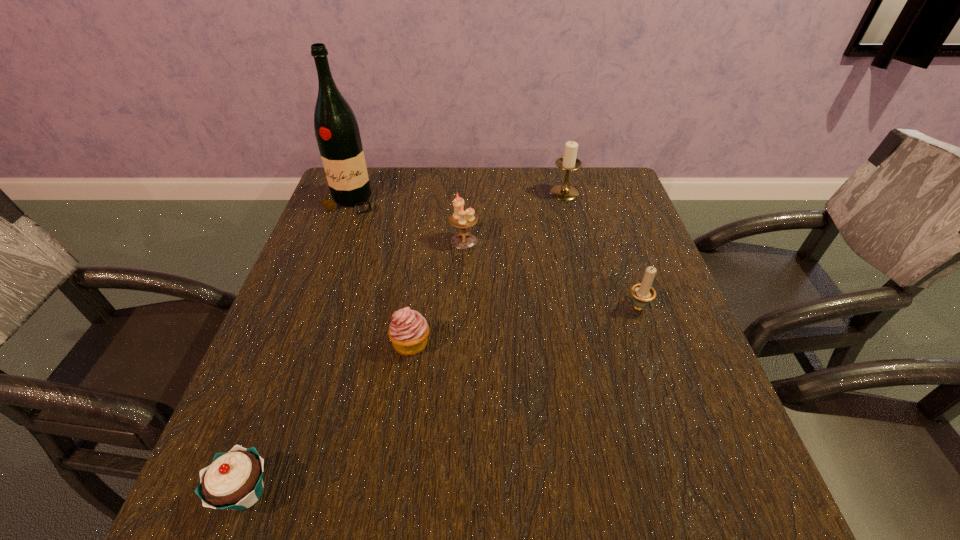
You are a GUI agent. You are given a task and a screenshot of the screen. Output one action in this format:
    pyautogui.click(x=<x>, y=<y>)
    Task: Click on the candle holder that is at the far edge
    
    Given the screenshot: What is the action you would take?
    pyautogui.click(x=568, y=162)

This screenshot has height=540, width=960. Find the location of `object situated at the near edge`. object situated at the near edge is located at coordinates (233, 481).

Image resolution: width=960 pixels, height=540 pixels. Find the location of `wine bottle at the left edge`. wine bottle at the left edge is located at coordinates (337, 133).

Locate an element on the screen. The height and width of the screenshot is (540, 960). cupcake situated at the left edge is located at coordinates (233, 481).

At what (x,y) coordinates should I click in order to perform the action: click on object present at the far left corner. Please return your answer as a coordinate pair (x, y). The height and width of the screenshot is (540, 960). Looking at the image, I should click on (337, 133).

Image resolution: width=960 pixels, height=540 pixels. What are the coordinates of `object at the near left corner` in the screenshot? It's located at (233, 481).

Identify the location of object that is positioned at the far right corner. The width and height of the screenshot is (960, 540). (568, 162).

Locate an element on the screen. free space at the far edge of the desktop is located at coordinates (437, 204).

This screenshot has height=540, width=960. I want to click on vacant area at the near edge, so click(x=396, y=491).

The width and height of the screenshot is (960, 540). Find the location of `vacant space at the left edge`. vacant space at the left edge is located at coordinates (308, 247).